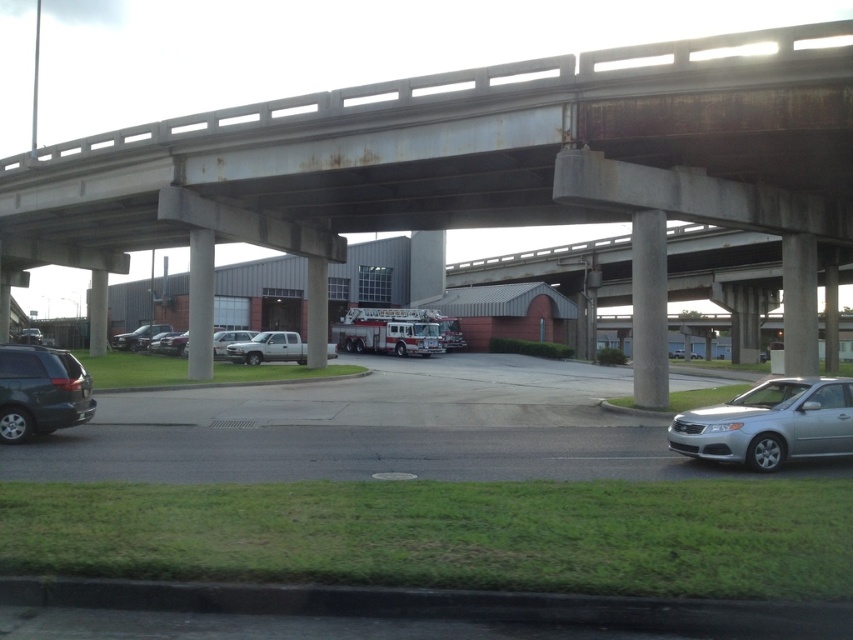
Looking at this image, which is more to the right, rusty concrete bridge at upper center or silver metallic sedan at lower right?

silver metallic sedan at lower right is more to the right.

Can you confirm if rusty concrete bridge at upper center is positioned to the left of silver metallic sedan at lower right?

Yes, rusty concrete bridge at upper center is to the left of silver metallic sedan at lower right.

Is point (59, 147) behind point (817, 396)?

Yes.

The image size is (853, 640). I want to click on rusty concrete bridge at upper center, so click(x=463, y=154).

Between rusty concrete bridge at upper center and satin silver car at lower right, which one appears on the right side from the viewer's perspective?

satin silver car at lower right

Does rusty concrete bridge at upper center have a smaller size compared to satin silver car at lower right?

Incorrect, rusty concrete bridge at upper center is not smaller in size than satin silver car at lower right.

Between point (621, 93) and point (85, 436), which one is positioned in front?

Positioned in front is point (85, 436).

Find the location of a particular element. The width and height of the screenshot is (853, 640). rusty concrete bridge at upper center is located at coordinates (463, 154).

This screenshot has width=853, height=640. Identify the location of white metallic fire truck at center. (396, 332).

Can you confirm if white metallic fire truck at center is smaller than shiny silver sedan at lower left?

No, white metallic fire truck at center is not smaller than shiny silver sedan at lower left.

Between point (379, 326) and point (131, 336), which one is positioned in front?

Point (379, 326) is in front.

What are the coordinates of `white metallic fire truck at center` in the screenshot? It's located at (396, 332).